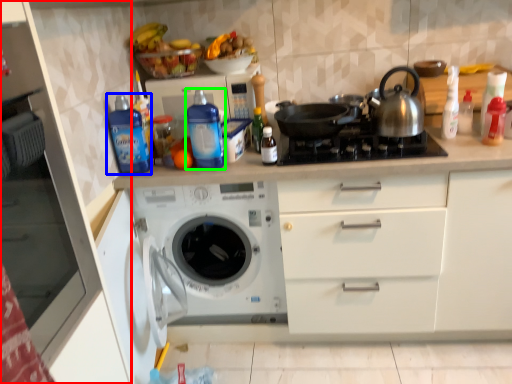
Question: Which is farther away from cabinetry (highlighted by a red box)? bottle (highlighted by a blue box) or bottle (highlighted by a green box)?

Choices:
 (A) bottle
 (B) bottle

Answer: (B)